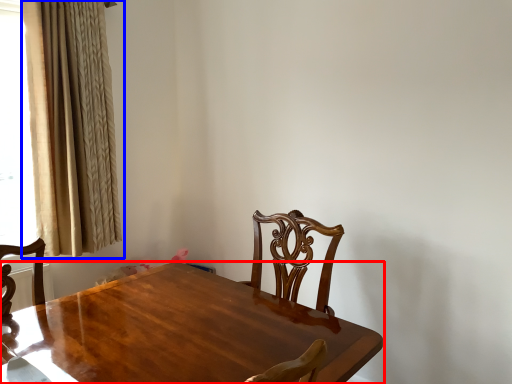
Question: Which object appears closest to the camera in this image, table (highlighted by a red box) or curtain (highlighted by a blue box)?

Choices:
 (A) table
 (B) curtain

Answer: (A)